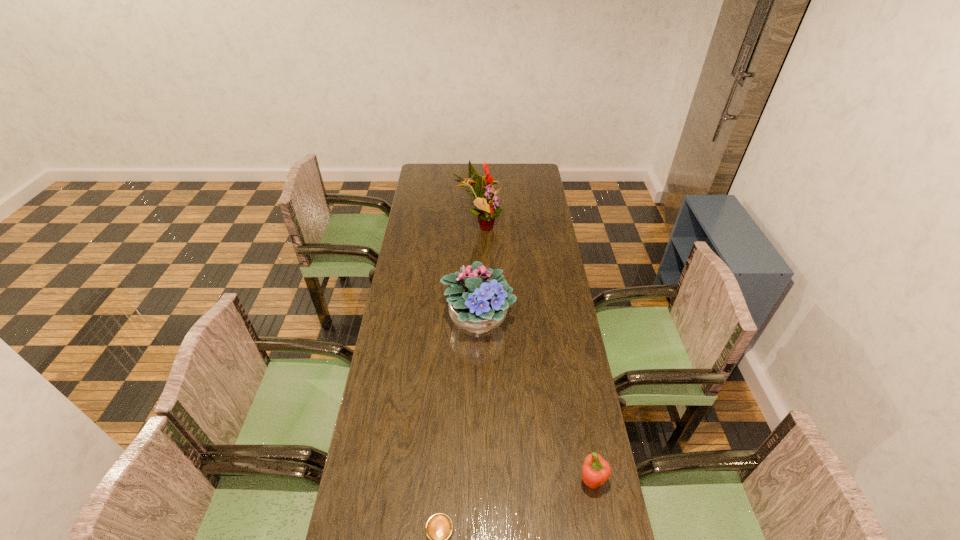
At what (x,y) coordinates should I click in order to perform the action: click on the farthest object. Please return your answer as a coordinate pair (x, y). Looking at the image, I should click on click(x=485, y=196).

The width and height of the screenshot is (960, 540). What are the coordinates of `the taller bouquet` in the screenshot? It's located at (485, 196).

I want to click on the third shortest object, so click(477, 306).

Find the location of `the third nearest object`. the third nearest object is located at coordinates (477, 306).

Locate an element on the screen. The image size is (960, 540). the rightmost object is located at coordinates (595, 471).

The height and width of the screenshot is (540, 960). Find the location of `the third farthest object`. the third farthest object is located at coordinates (595, 471).

What are the coordinates of `vacant space situated on the front-facing side of the farthest object` in the screenshot? It's located at (520, 225).

At what (x,y) coordinates should I click in order to perform the action: click on free region located 0.100m on the front of the third nearest object. Please return your answer as a coordinate pair (x, y). Looking at the image, I should click on (477, 373).

This screenshot has height=540, width=960. Find the location of `free spot located on the back of the rightmost object`. free spot located on the back of the rightmost object is located at coordinates (575, 394).

You are a GUI agent. You are given a task and a screenshot of the screen. Output one action in this format:
    pyautogui.click(x=<x>, y=<y>)
    Task: Click on the object that is at the right edge
    The image size is (960, 540).
    Given the screenshot: What is the action you would take?
    pyautogui.click(x=595, y=471)